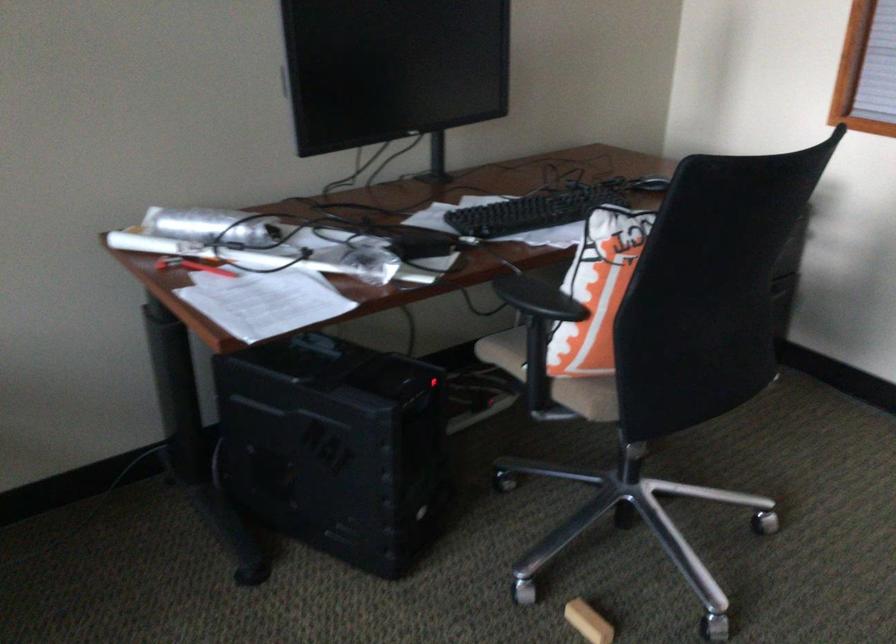
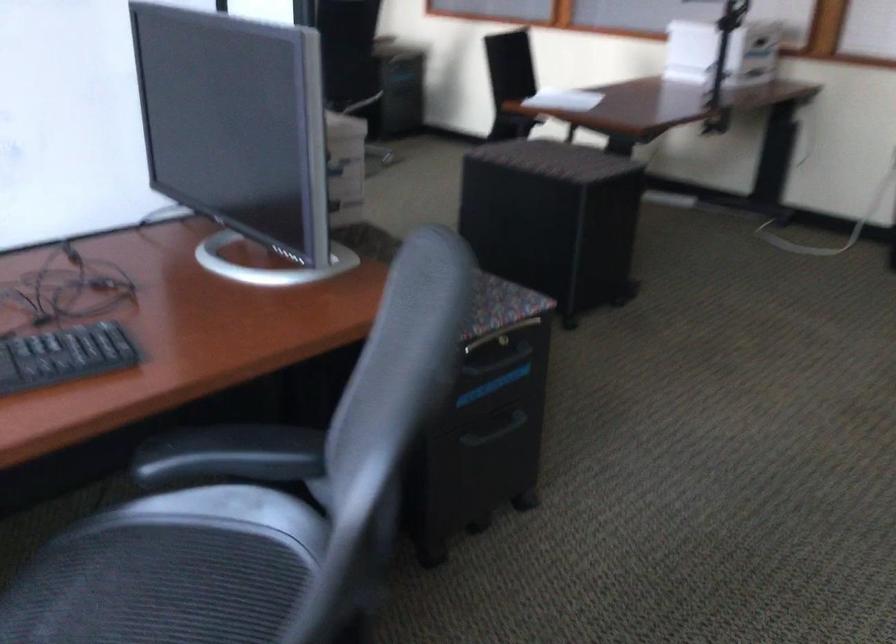
Question: Which direction would the cameraman need to move to produce the second image? Reply with the corresponding letter.

Choices:
 (A) Left
 (B) Right
 (C) Forward
 (D) Backward

Answer: (D)